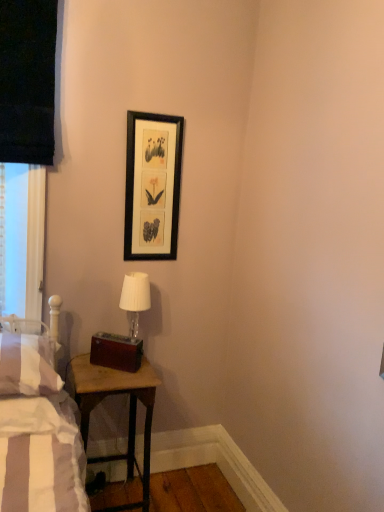
Question: Which is correct: black matte picture frame at upper center is inside white striped pillow at left, or outside of it?

Choices:
 (A) outside
 (B) inside

Answer: (A)

Question: From a real-world perspective, relative to white striped pillow at left, is black matte picture frame at upper center vertically above or below?

Choices:
 (A) below
 (B) above

Answer: (B)

Question: Which object is positioned closest to the wooden table at lower left?

Choices:
 (A) white fabric lampshade at center
 (B) white striped pillow at left
 (C) black matte picture frame at upper center

Answer: (B)

Question: Considering the real-world distances, which object is closest to the white striped pillow at left?

Choices:
 (A) black matte picture frame at upper center
 (B) wooden table at lower left
 (C) white fabric lampshade at center

Answer: (B)